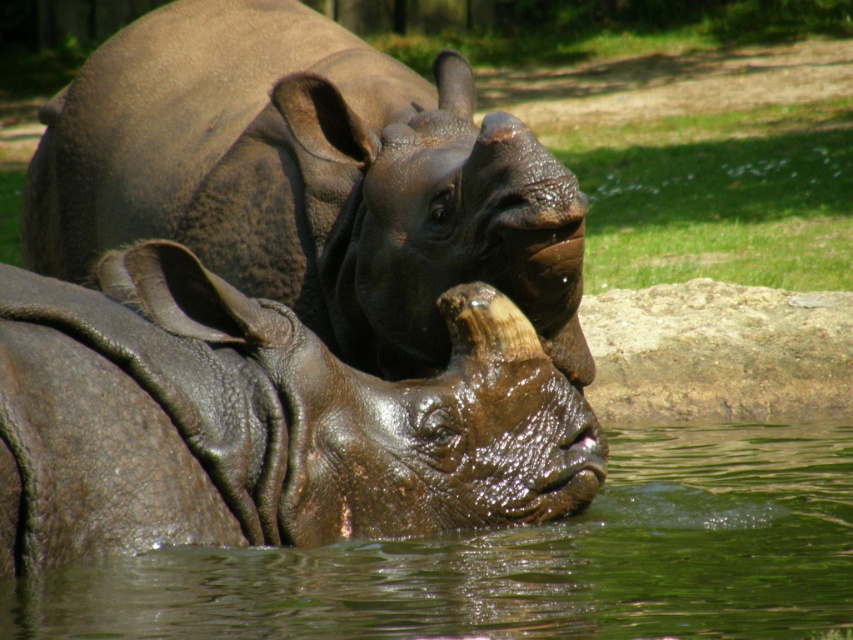
Which is more to the right, leather-like dark brown rhinoceros at center or green liquid water at lower center?

From the viewer's perspective, green liquid water at lower center appears more on the right side.

Does point (357, 352) lie in front of point (776, 540)?

No, (357, 352) is further to viewer.

At what (x,y) coordinates should I click in order to perform the action: click on leather-like dark brown rhinoceros at center. Please return your answer as a coordinate pair (x, y). Image resolution: width=853 pixels, height=640 pixels. Looking at the image, I should click on (308, 180).

Is leather-like dark brown rhinoceros at center closer to camera compared to wet brown rhinoceros at center?

No.

Who is taller, leather-like dark brown rhinoceros at center or wet brown rhinoceros at center?

Standing taller between the two is leather-like dark brown rhinoceros at center.

What do you see at coordinates (308, 180) in the screenshot?
I see `leather-like dark brown rhinoceros at center` at bounding box center [308, 180].

Locate an element on the screen. leather-like dark brown rhinoceros at center is located at coordinates (x=308, y=180).

Can you confirm if wet brown rhinoceros at center is thinner than green liquid water at lower center?

Yes.

Does wet brown rhinoceros at center appear over green liquid water at lower center?

Yes.

Does point (57, 412) come farther from viewer compared to point (239, 582)?

That is False.

I want to click on wet brown rhinoceros at center, so click(262, 420).